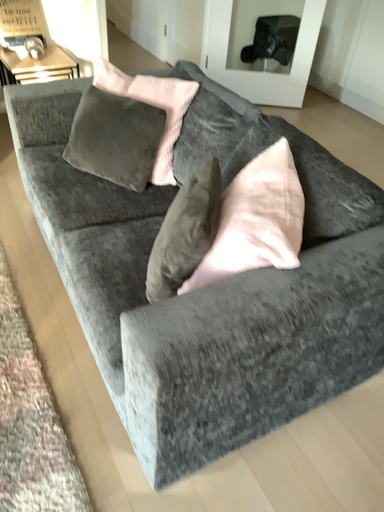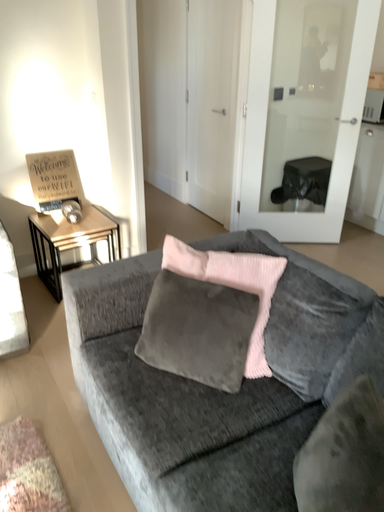
Question: Which way did the camera rotate in the video?

Choices:
 (A) rotated downward
 (B) rotated upward

Answer: (B)